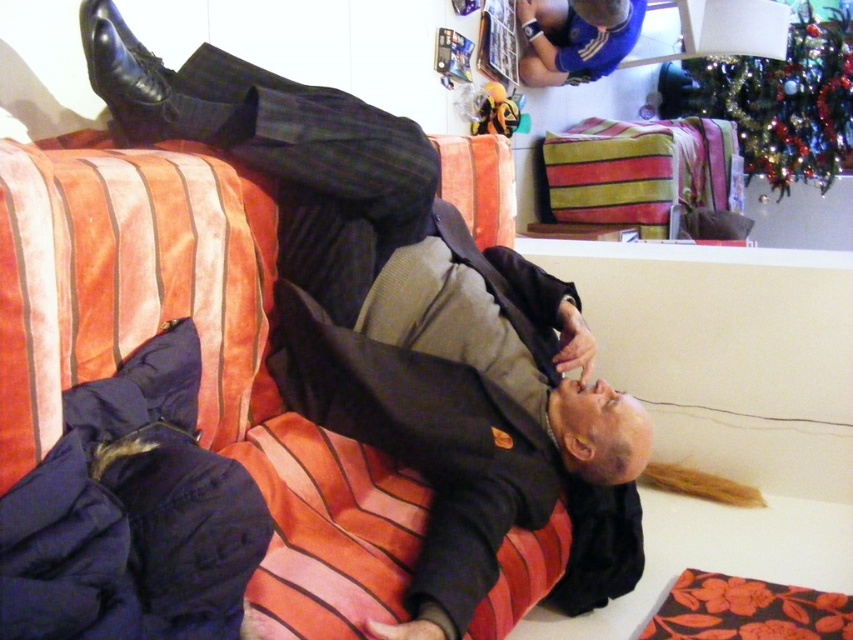
Question: Which point is farther to the camera?

Choices:
 (A) blue jersey at upper center
 (B) velvet striped couch at center

Answer: (A)

Question: Which object is farther from the camera taking this photo?

Choices:
 (A) blue jersey at upper center
 (B) velvet striped couch at center

Answer: (A)

Question: Considering the relative positions of velvet striped couch at center and blue jersey at upper center in the image provided, where is velvet striped couch at center located with respect to blue jersey at upper center?

Choices:
 (A) left
 (B) right

Answer: (A)

Question: In this image, where is velvet striped couch at center located relative to blue jersey at upper center?

Choices:
 (A) below
 (B) above

Answer: (A)

Question: Does velvet striped couch at center appear on the left side of blue jersey at upper center?

Choices:
 (A) yes
 (B) no

Answer: (A)